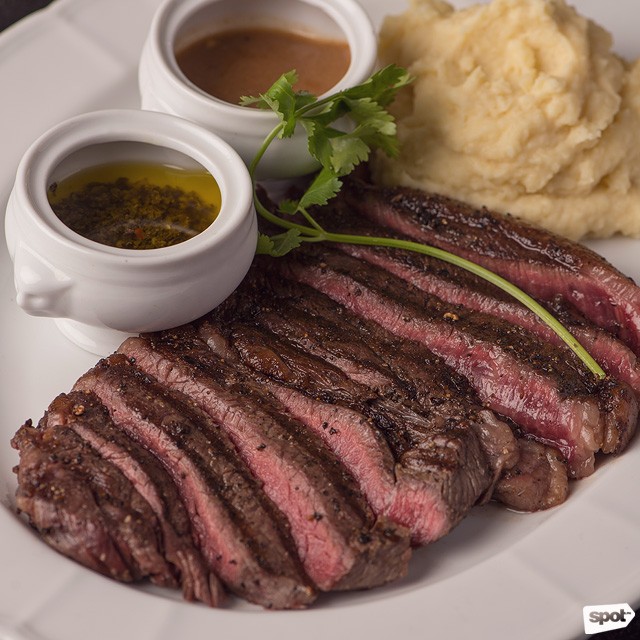
You are a GUI agent. You are given a task and a screenshot of the screen. Output one action in this format:
    pyautogui.click(x=<x>, y=<y>)
    Task: Click on the plate
    The image size is (640, 640).
    Given the screenshot: What is the action you would take?
    pyautogui.click(x=502, y=563)